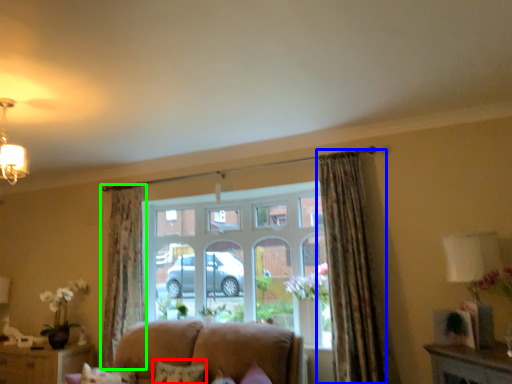
Question: Based on their relative distances, which object is farther from pillow (highlighted by a red box)? Choose from curtain (highlighted by a blue box) and curtain (highlighted by a green box).

Choices:
 (A) curtain
 (B) curtain

Answer: (B)